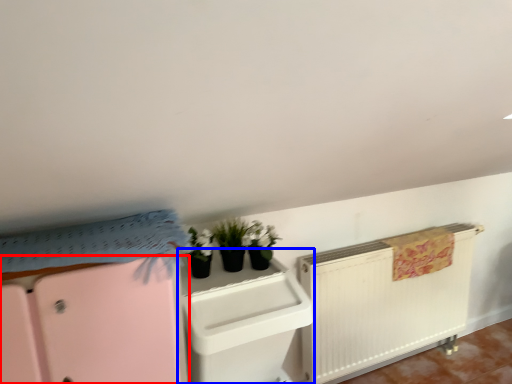
Question: Which object appears farthest to the camera in this image, file cabinet (highlighted by a red box) or file cabinet (highlighted by a blue box)?

Choices:
 (A) file cabinet
 (B) file cabinet

Answer: (B)